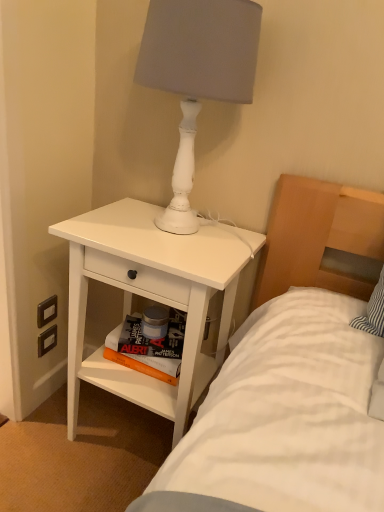
Question: From a real-world perspective, is matte white switch at lower left, marked as the 2th electric outlet in a bottom-to-top arrangement, physically below black plastic electric outlet at lower left, the second electric outlet positioned from the top?

Choices:
 (A) no
 (B) yes

Answer: (A)

Question: Is matte white switch at lower left, the first electric outlet viewed from the top, completely or partially outside of black plastic electric outlet at lower left, the second electric outlet positioned from the top?

Choices:
 (A) no
 (B) yes

Answer: (B)

Question: Could black plastic electric outlet at lower left, the 1th electric outlet from the bottom, be considered to be inside matte white switch at lower left, marked as the 2th electric outlet in a bottom-to-top arrangement?

Choices:
 (A) no
 (B) yes

Answer: (A)

Question: Does matte white switch at lower left, the first electric outlet viewed from the top, have a larger size compared to black plastic electric outlet at lower left, the second electric outlet positioned from the top?

Choices:
 (A) no
 (B) yes

Answer: (B)

Question: Is matte white switch at lower left, marked as the 2th electric outlet in a bottom-to-top arrangement, smaller than black plastic electric outlet at lower left, the second electric outlet positioned from the top?

Choices:
 (A) no
 (B) yes

Answer: (A)

Question: Considering the relative sizes of matte white switch at lower left, marked as the 2th electric outlet in a bottom-to-top arrangement, and black plastic electric outlet at lower left, the second electric outlet positioned from the top, in the image provided, is matte white switch at lower left, marked as the 2th electric outlet in a bottom-to-top arrangement, wider than black plastic electric outlet at lower left, the second electric outlet positioned from the top,?

Choices:
 (A) yes
 (B) no

Answer: (A)

Question: Is orange matte book at lower center, the first magazine in the bottom-to-top sequence, bigger than matte white switch at lower left, the first electric outlet viewed from the top?

Choices:
 (A) yes
 (B) no

Answer: (A)

Question: From the image's perspective, is orange matte book at lower center, the first magazine in the bottom-to-top sequence, below matte white switch at lower left, marked as the 2th electric outlet in a bottom-to-top arrangement?

Choices:
 (A) no
 (B) yes

Answer: (B)

Question: Considering the relative positions of orange matte book at lower center, which is the 2th magazine from top to bottom, and matte white switch at lower left, marked as the 2th electric outlet in a bottom-to-top arrangement, in the image provided, is orange matte book at lower center, which is the 2th magazine from top to bottom, to the left of matte white switch at lower left, marked as the 2th electric outlet in a bottom-to-top arrangement, from the viewer's perspective?

Choices:
 (A) yes
 (B) no

Answer: (B)

Question: Is orange matte book at lower center, the first magazine in the bottom-to-top sequence, positioned before matte white switch at lower left, the first electric outlet viewed from the top?

Choices:
 (A) no
 (B) yes

Answer: (B)

Question: Is orange matte book at lower center, which is the 2th magazine from top to bottom, to the right of matte white switch at lower left, marked as the 2th electric outlet in a bottom-to-top arrangement, from the viewer's perspective?

Choices:
 (A) no
 (B) yes

Answer: (B)

Question: Is orange matte book at lower center, which is the 2th magazine from top to bottom, oriented towards matte white switch at lower left, marked as the 2th electric outlet in a bottom-to-top arrangement?

Choices:
 (A) no
 (B) yes

Answer: (A)

Question: From the image's perspective, does white matte nightstand at lower left appear higher than black plastic electric outlet at lower left, the second electric outlet positioned from the top?

Choices:
 (A) yes
 (B) no

Answer: (A)